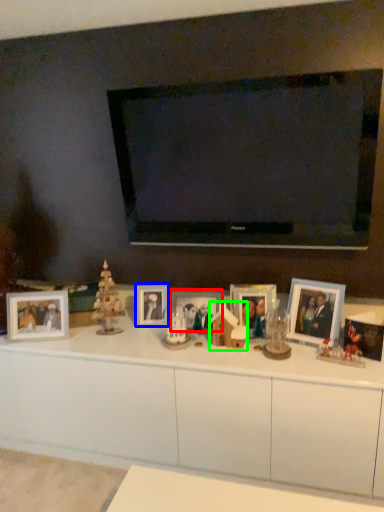
Question: Considering the real-world distances, which object is farthest from picture frame (highlighted by a red box)? picture frame (highlighted by a blue box) or toy (highlighted by a green box)?

Choices:
 (A) picture frame
 (B) toy

Answer: (A)